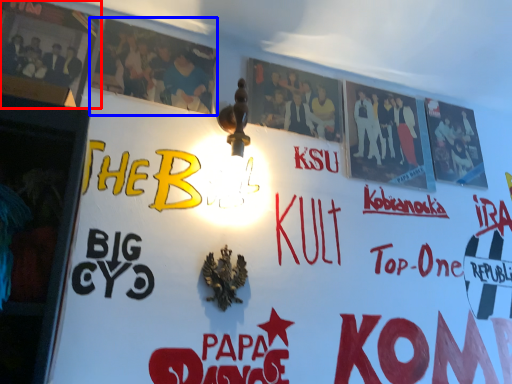
Question: Which object appears closest to the camera in this image, poster (highlighted by a red box) or poster (highlighted by a blue box)?

Choices:
 (A) poster
 (B) poster

Answer: (A)